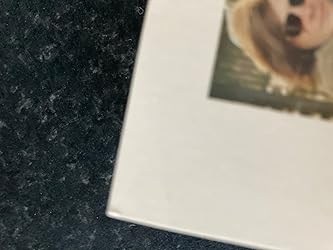
At what (x,y) coordinates should I click in order to perform the action: click on corner of white border or frame. Please return your answer as a coordinate pair (x, y). Looking at the image, I should click on (109, 212).